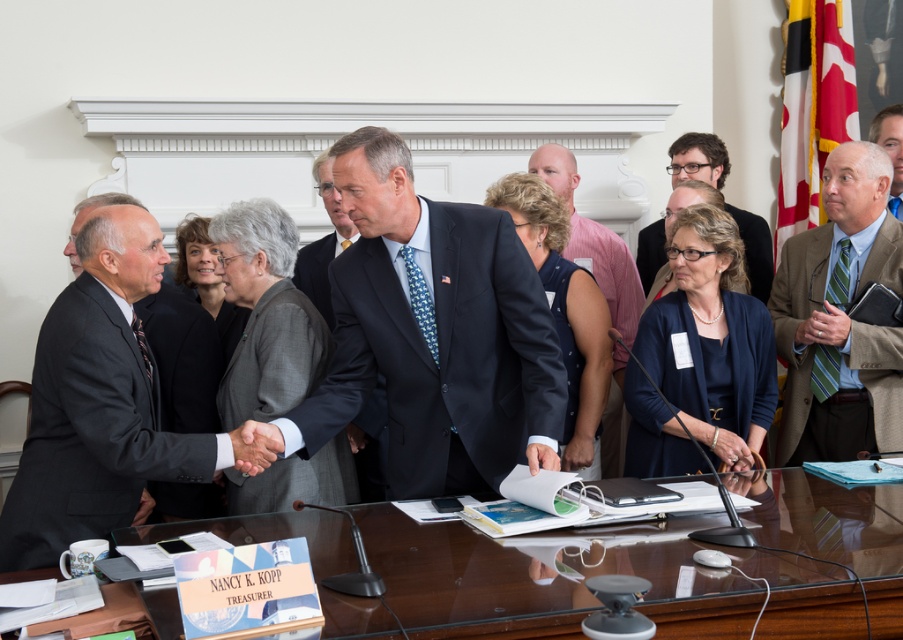
Question: Among these points, which one is farthest from the camera?

Choices:
 (A) (864, 333)
 (B) (604, 470)
 (C) (892, 156)

Answer: (C)

Question: Can you confirm if dark gray wool suit at center is positioned to the left of matte brown leather hand at center?

Choices:
 (A) no
 (B) yes

Answer: (B)

Question: Which point is farther to the camera?

Choices:
 (A) dark gray wool suit at center
 (B) dark gray suit at left
 (C) blue suit at center
 (D) matte black hand at lower center

Answer: (C)

Question: Does dark blue suit at center have a lesser width compared to green striped tie at right?

Choices:
 (A) no
 (B) yes

Answer: (A)

Question: Does dark blue suit at center have a larger size compared to matte black hand at lower center?

Choices:
 (A) no
 (B) yes

Answer: (B)

Question: Which of the following is the closest to the observer?

Choices:
 (A) (885, 420)
 (B) (253, 435)

Answer: (B)